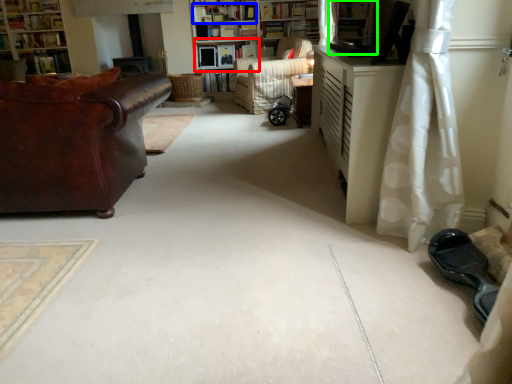
Question: Which object is the farthest from shelf (highlighted by a red box)? Choose among these: book (highlighted by a blue box) or shelf (highlighted by a green box).

Choices:
 (A) book
 (B) shelf

Answer: (B)